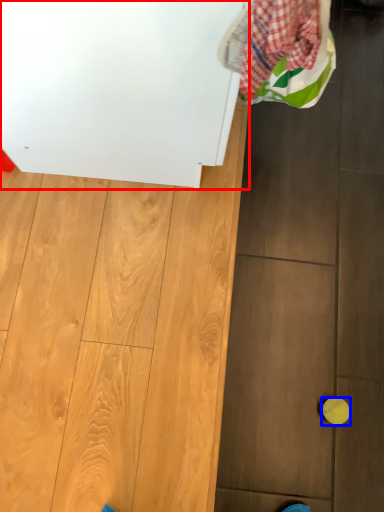
Question: Which object is further to the camera taking this photo, appliance (highlighted by a red box) or ball (highlighted by a blue box)?

Choices:
 (A) appliance
 (B) ball

Answer: (B)